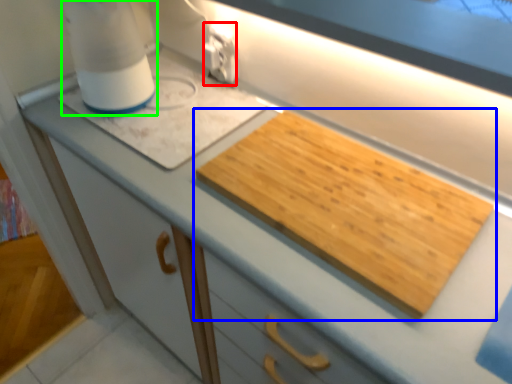
Question: Based on their relative distances, which object is nearer to electric outlet (highlighted by a red box)? Choose from cutting board (highlighted by a blue box) and blender (highlighted by a green box).

Choices:
 (A) cutting board
 (B) blender

Answer: (B)